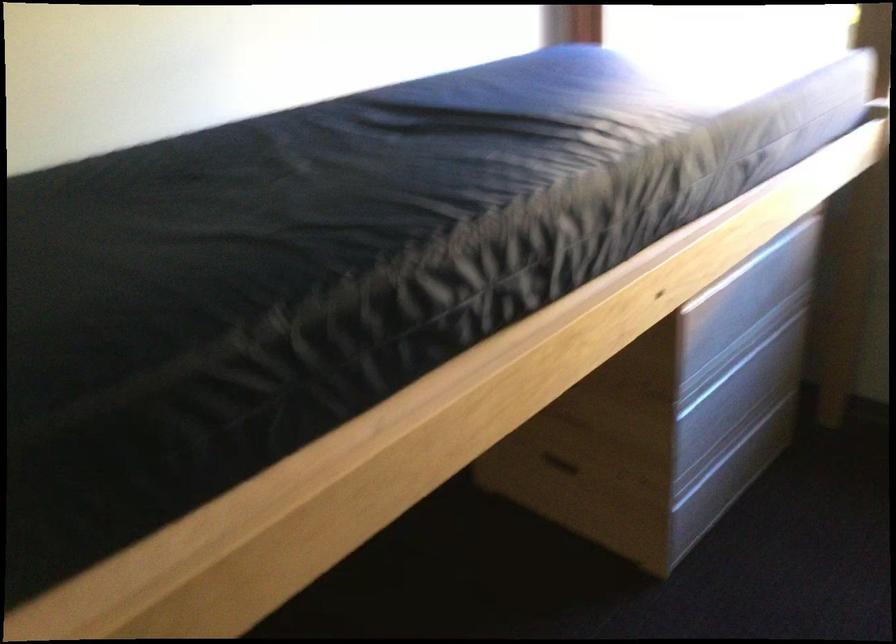
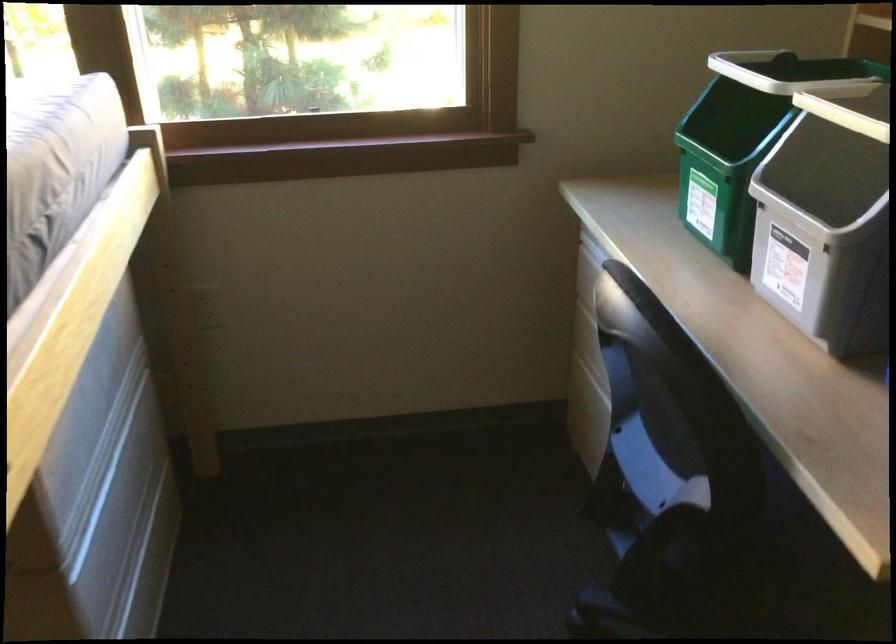
Question: The camera is either moving clockwise (left) or counter-clockwise (right) around the object. The first image is from the beginning of the video and the second image is from the end. Is the camera moving left or right when shooting the video?

Choices:
 (A) Left
 (B) Right

Answer: (A)